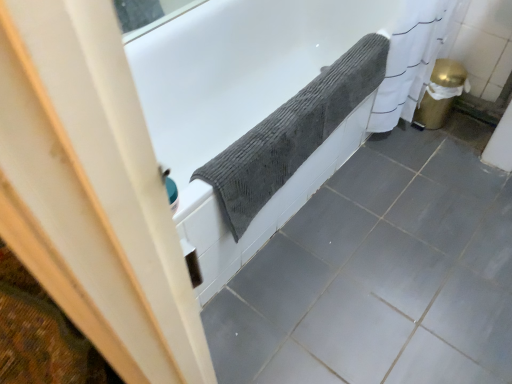
Where is `free space above textured gray towel at upper center, the 1th ceramic tile ordered from the bottom (from a real-world perspective)`? Image resolution: width=512 pixels, height=384 pixels. free space above textured gray towel at upper center, the 1th ceramic tile ordered from the bottom (from a real-world perspective) is located at coordinates (402, 258).